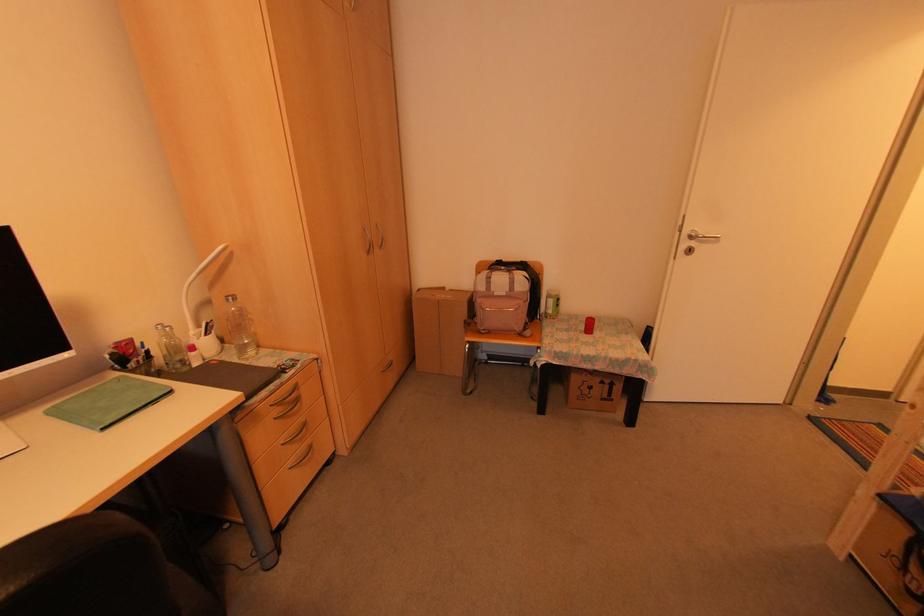
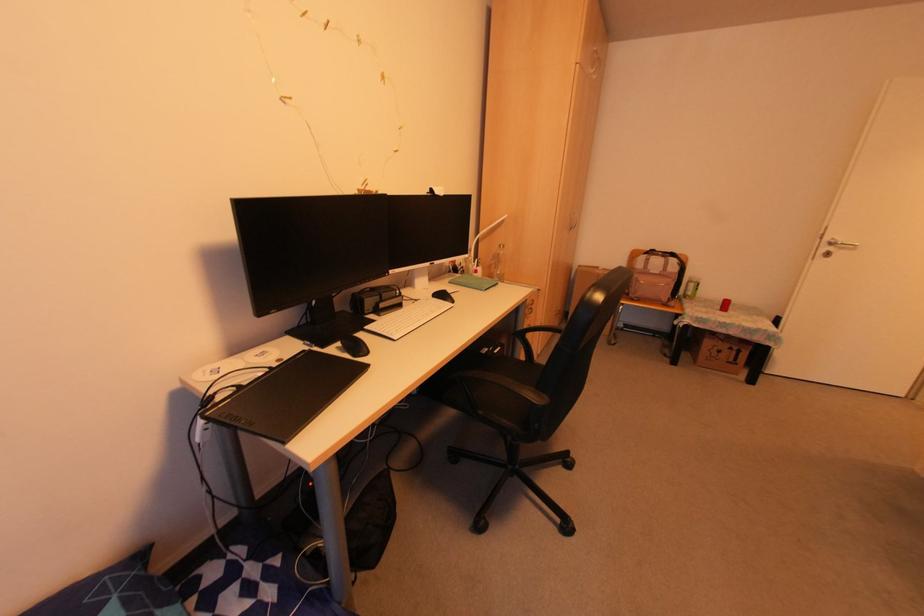
Where in the second image is the point corresponding to the point at 687,251 from the first image?

(825, 254)